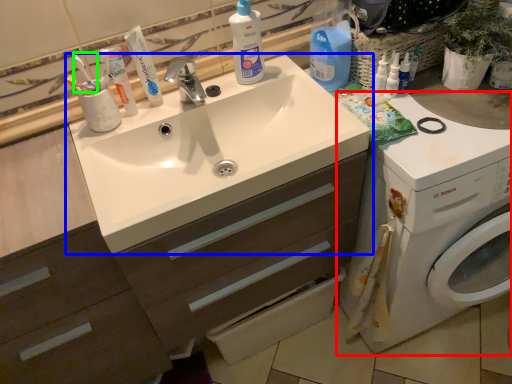
Question: Which object is positioned closest to washing machine (highlighted by a red box)? Select from sink (highlighted by a blue box) and toothbrush (highlighted by a green box).

Choices:
 (A) sink
 (B) toothbrush

Answer: (A)